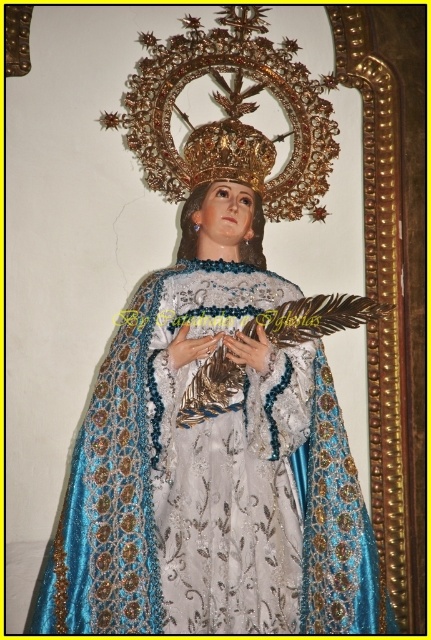
Question: Which object is closer to the camera taking this photo?

Choices:
 (A) silky blue fabric dress at center
 (B) matte gold head at center
 (C) gold/gilded metal/crown at upper center

Answer: (A)

Question: Is silky blue fabric dress at center in front of matte gold head at center?

Choices:
 (A) yes
 (B) no

Answer: (A)

Question: Which point is farther from the camera taking this photo?

Choices:
 (A) (228, 352)
 (B) (180, 186)

Answer: (B)

Question: Can you confirm if silky blue fabric dress at center is smaller than matte gold head at center?

Choices:
 (A) no
 (B) yes

Answer: (A)

Question: Is gold/gilded metal/crown at upper center smaller than matte gold head at center?

Choices:
 (A) no
 (B) yes

Answer: (A)

Question: Which object is positioned closest to the matte gold head at center?

Choices:
 (A) gold/gilded metal/crown at upper center
 (B) silky blue fabric dress at center

Answer: (A)